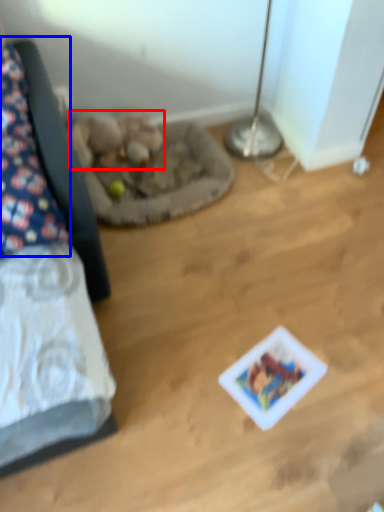
Question: Which object appears farthest to the camera in this image, animal (highlighted by a red box) or pillow (highlighted by a blue box)?

Choices:
 (A) animal
 (B) pillow

Answer: (A)